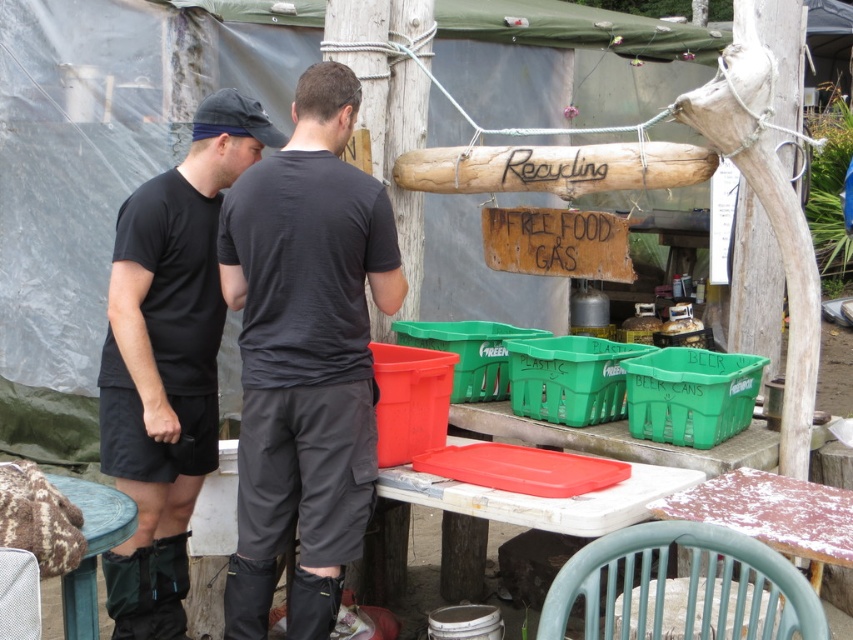
In the scene shown: Is black matte t-shirt at left closer to the viewer compared to wooden table at lower left?

That is False.

Looking at this image, which is more to the right, black matte t-shirt at left or wooden table at lower left?

black matte t-shirt at left

Describe the element at coordinates (167, 360) in the screenshot. I see `black matte t-shirt at left` at that location.

The height and width of the screenshot is (640, 853). I want to click on black matte t-shirt at left, so click(167, 360).

Can you confirm if dark gray cotton shirt at center is positioned above wooden table at lower left?

Correct, dark gray cotton shirt at center is located above wooden table at lower left.

Which is behind, point (286, 172) or point (122, 522)?

Point (286, 172)

Where is `dark gray cotton shirt at center`? This screenshot has height=640, width=853. dark gray cotton shirt at center is located at coordinates (305, 356).

Is black matte t-shirt at left smaller than white plastic table at center?

Actually, black matte t-shirt at left might be larger than white plastic table at center.

Which is in front, point (149, 380) or point (583, 525)?

Positioned in front is point (583, 525).

The image size is (853, 640). I want to click on black matte t-shirt at left, so click(x=167, y=360).